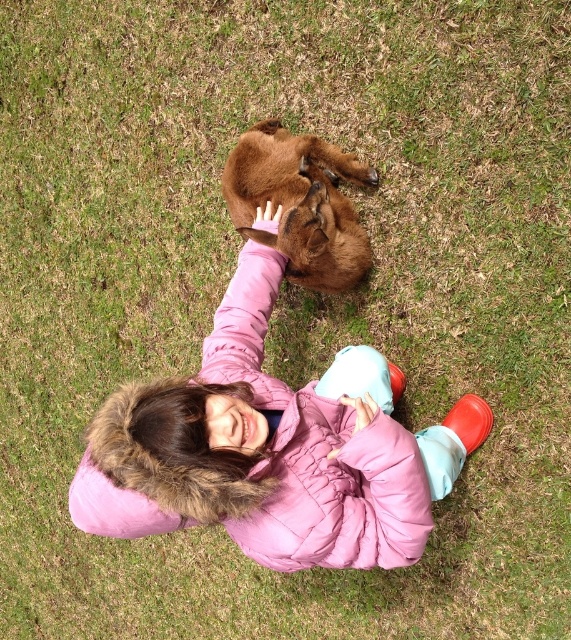
Question: Which object is closer to the camera taking this photo?

Choices:
 (A) pink quilted jacket at center
 (B) brown furry dog at center

Answer: (A)

Question: Is pink quilted jacket at center smaller than brown furry dog at center?

Choices:
 (A) yes
 (B) no

Answer: (B)

Question: Does pink quilted jacket at center appear over brown furry dog at center?

Choices:
 (A) yes
 (B) no

Answer: (B)

Question: Does pink quilted jacket at center appear under brown furry dog at center?

Choices:
 (A) yes
 (B) no

Answer: (A)

Question: Which point is closer to the camera?

Choices:
 (A) brown furry dog at center
 (B) pink quilted jacket at center

Answer: (B)

Question: Which of the following is the closest to the observer?

Choices:
 (A) brown furry dog at center
 (B) pink quilted jacket at center

Answer: (B)